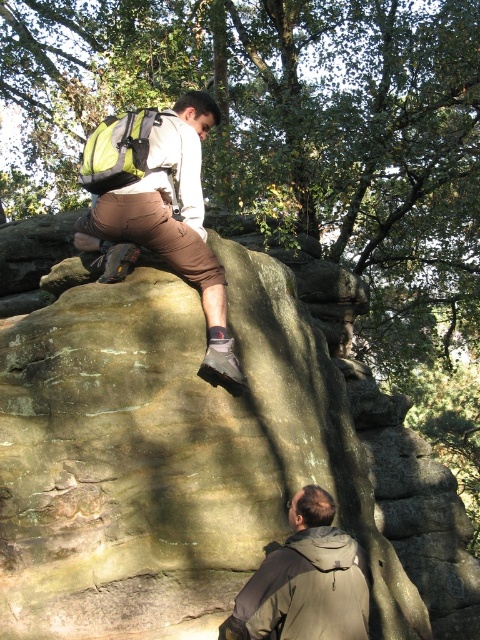
Question: Which object is closer to the camera taking this photo?

Choices:
 (A) matte brown pants at upper center
 (B) green fabric safety vest at upper left

Answer: (A)

Question: Can you confirm if matte brown pants at upper center is positioned to the left of green fabric safety vest at upper left?

Choices:
 (A) yes
 (B) no

Answer: (B)

Question: Which of the following is the farthest from the observer?

Choices:
 (A) (109, 141)
 (B) (147, 120)
 (C) (337, 628)

Answer: (B)

Question: Is matte brown pants at upper center to the left of khaki fabric jacket at lower right from the viewer's perspective?

Choices:
 (A) yes
 (B) no

Answer: (A)

Question: Is khaki fabric jacket at lower right to the right of green fabric safety vest at upper left from the viewer's perspective?

Choices:
 (A) yes
 (B) no

Answer: (A)

Question: Which object is the closest to the matte brown pants at upper center?

Choices:
 (A) khaki fabric jacket at lower right
 (B) green fabric safety vest at upper left

Answer: (B)